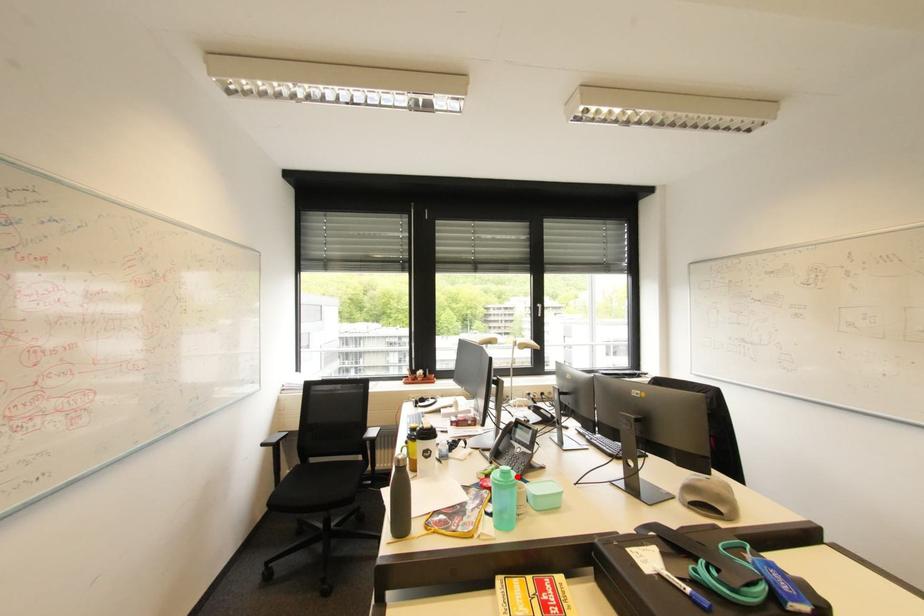
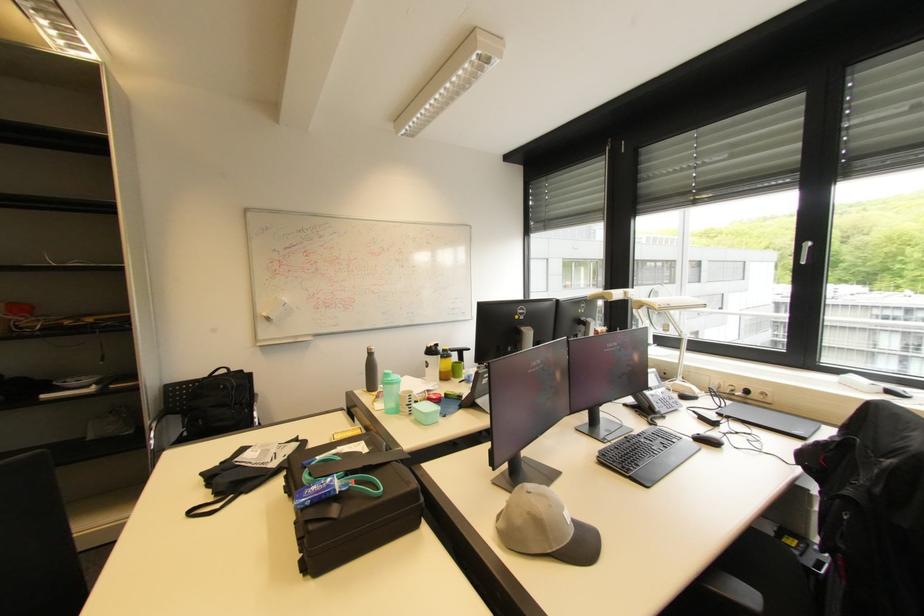
Question: I am providing you with two images of the same scene from different viewpoints. A red point is marked on the first image. Can you still see the location of the red point in image 2?

Choices:
 (A) Yes
 (B) No

Answer: (A)